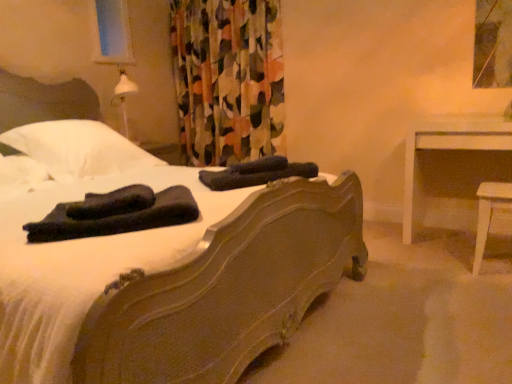
Question: From the image's perspective, would you say white glossy table at right is positioned over dark blue fabric at center, the first material viewed from the top?

Choices:
 (A) yes
 (B) no

Answer: (B)

Question: Is white glossy table at right completely or partially outside of dark blue fabric at center, which is the first material from back to front?

Choices:
 (A) no
 (B) yes

Answer: (B)

Question: Is white glossy table at right wider than dark blue fabric at center, which is the first material from back to front?

Choices:
 (A) no
 (B) yes

Answer: (B)

Question: Is white glossy table at right to the right of dark blue fabric at center, the second material positioned from the left, from the viewer's perspective?

Choices:
 (A) yes
 (B) no

Answer: (A)

Question: Does white glossy table at right turn towards dark blue fabric at center, the first material viewed from the top?

Choices:
 (A) no
 (B) yes

Answer: (A)

Question: Is point (111, 200) positioned closer to the camera than point (253, 144)?

Choices:
 (A) closer
 (B) farther

Answer: (A)

Question: Based on their positions, is black fabric at bed, acting as the second material starting from the top, located to the left or right of floral fabric curtain at upper center?

Choices:
 (A) left
 (B) right

Answer: (A)

Question: From the image's perspective, relative to floral fabric curtain at upper center, is black fabric at bed, arranged as the 1th material when viewed from the left, above or below?

Choices:
 (A) above
 (B) below

Answer: (B)

Question: Is black fabric at bed, arranged as the first material when viewed from the front, spatially inside floral fabric curtain at upper center, or outside of it?

Choices:
 (A) outside
 (B) inside

Answer: (A)

Question: From a real-world perspective, is white soft pillow at left above or below brown wooden bed at center?

Choices:
 (A) below
 (B) above

Answer: (B)

Question: In terms of width, does white soft pillow at left look wider or thinner when compared to brown wooden bed at center?

Choices:
 (A) thin
 (B) wide

Answer: (A)

Question: From their relative heights in the image, would you say white soft pillow at left is taller or shorter than brown wooden bed at center?

Choices:
 (A) short
 (B) tall

Answer: (A)

Question: Relative to brown wooden bed at center, is white soft pillow at left in front or behind?

Choices:
 (A) behind
 (B) front

Answer: (A)

Question: Is dark blue fabric at center, which is the first material from back to front, in front of or behind brown wooden bed at center in the image?

Choices:
 (A) front
 (B) behind

Answer: (B)

Question: From a real-world perspective, is dark blue fabric at center, marked as the first material in a right-to-left arrangement, positioned above or below brown wooden bed at center?

Choices:
 (A) above
 (B) below

Answer: (B)